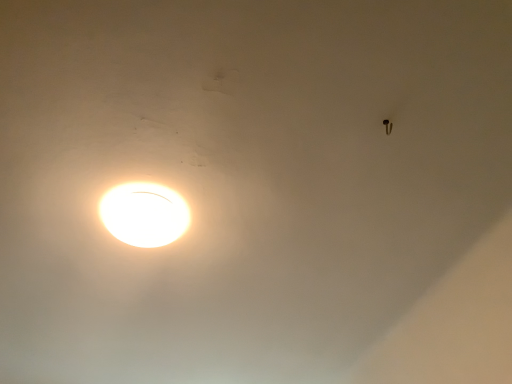
What do you see at coordinates (144, 214) in the screenshot?
I see `white glossy lamp at upper left` at bounding box center [144, 214].

Measure the distance between point (x=116, y=230) and camera.

The distance of point (x=116, y=230) from camera is 5.36 feet.

Measure the distance between white glossy lamp at upper left and camera.

white glossy lamp at upper left and camera are 1.57 meters apart from each other.

Find the location of a particular element. Image resolution: width=512 pixels, height=384 pixels. white glossy lamp at upper left is located at coordinates (144, 214).

The width and height of the screenshot is (512, 384). I want to click on white glossy lamp at upper left, so click(144, 214).